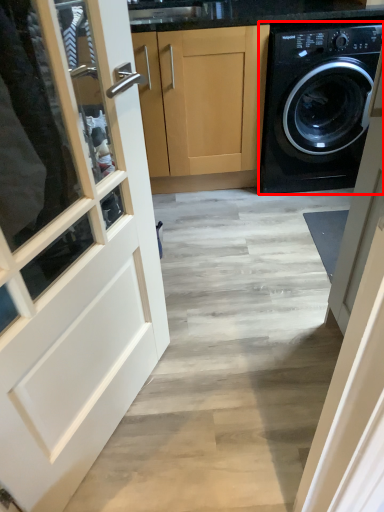
Question: From the image's perspective, considering the relative positions of washing machine (annotated by the red box) and cabinetry in the image provided, where is washing machine (annotated by the red box) located with respect to the staircase?

Choices:
 (A) below
 (B) above

Answer: (B)